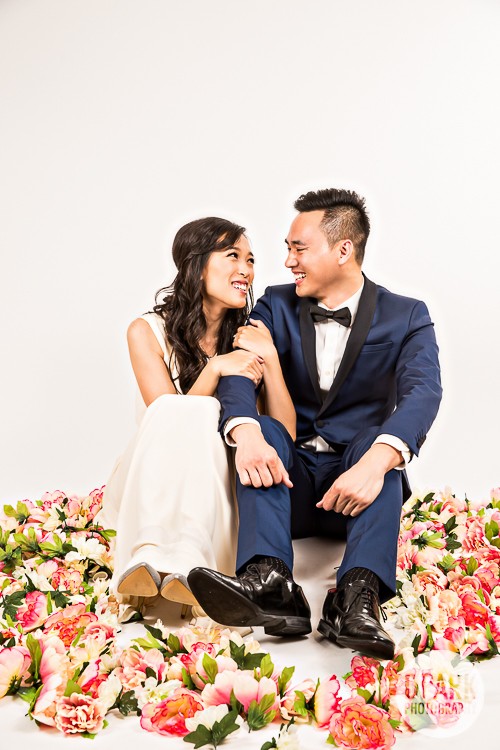
This screenshot has width=500, height=750. Find the location of `wall`. wall is located at coordinates [x=40, y=396].